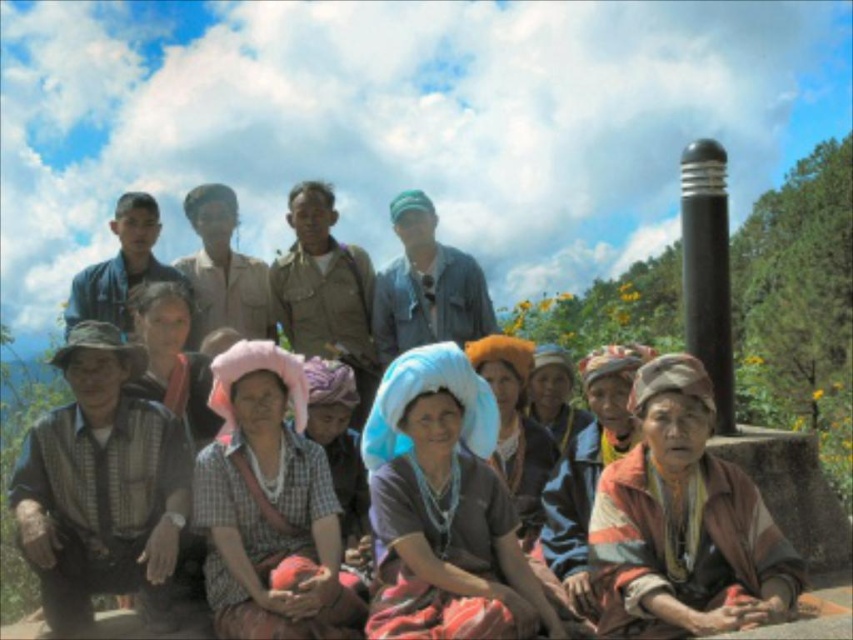
You are a photographer trying to capture the striped fabric headscarf at lower right and the matte blue headscarf at center in a single frame. Which headscarf will appear narrower in the photo?

The striped fabric headscarf at lower right is thinner than the matte blue headscarf at center, so it will appear narrower in the photo.

You are a photographer trying to capture a closeup of the headscarves in the image. You can only focus on one headscarve at a time. If you focus on the matte blue fabric headscarf at center, will the multicolored fabric headscarf at lower right be in focus too?

The matte blue fabric headscarf at center might be wider than multicolored fabric headscarf at lower right, but since depth of field depends on factors like distance and aperture, it is uncertain if both would be in focus. Adjust your camera settings or focus accordingly.

You are a photographer trying to capture a closeup of the blue fabric headscarf at center and the matte blue headscarf at center. Since you want both to be in focus, which one should you focus on first to ensure the other is also in focus?

The blue fabric headscarf at center is larger in size than the matte blue headscarf at center, so you should focus on the larger one first to ensure both are in focus.